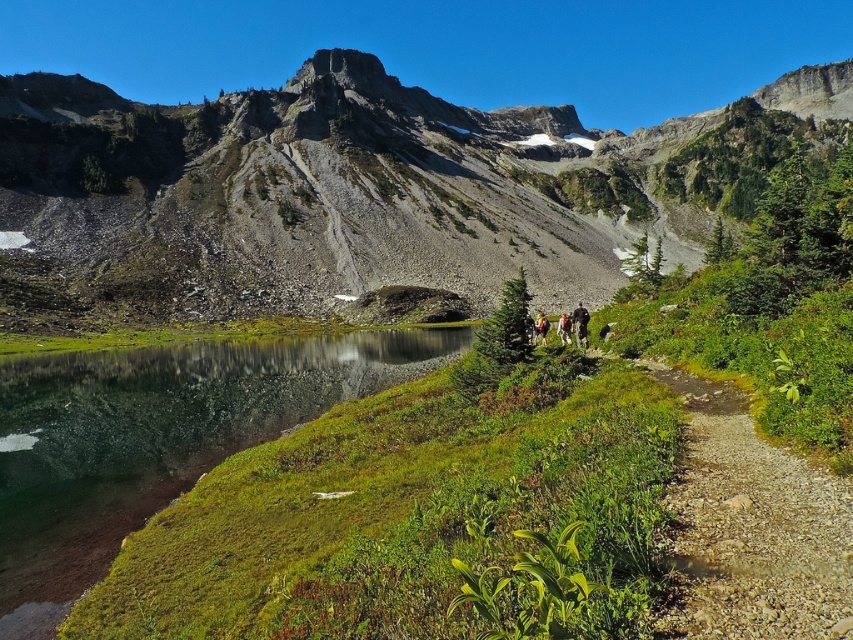
Question: Is gravelly dirt path at center-right to the left of camouflage fabric jacket at center from the viewer's perspective?

Choices:
 (A) no
 (B) yes

Answer: (A)

Question: Considering the real-world distances, which object is closest to the rugged granite mountain at center?

Choices:
 (A) dark blue jacket at center-right
 (B) dark gray jacket at center
 (C) clear glass lake at lower left

Answer: (C)

Question: In this image, where is clear glass lake at lower left located relative to dark blue jacket at center-right?

Choices:
 (A) right
 (B) left

Answer: (B)

Question: Does clear glass lake at lower left appear on the left side of gravelly dirt path at center-right?

Choices:
 (A) no
 (B) yes

Answer: (B)

Question: Which point is farther from the camera taking this photo?

Choices:
 (A) (544, 324)
 (B) (573, 326)
 (C) (564, 321)

Answer: (A)

Question: Which point is farther to the camera?

Choices:
 (A) clear glass lake at lower left
 (B) dark blue jacket at center-right

Answer: (B)